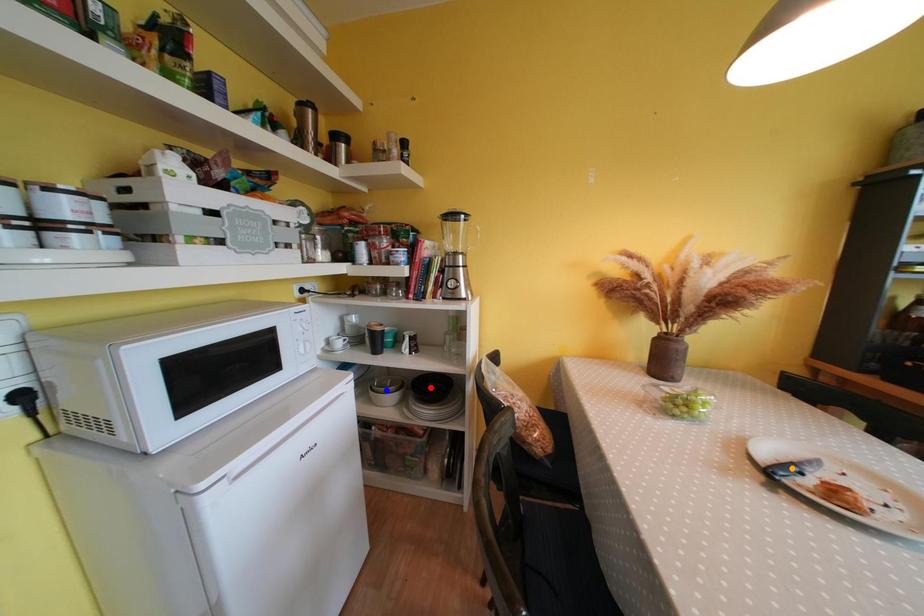
Order these from nearest to farthest:
- red point
- blue point
- orange point

1. orange point
2. red point
3. blue point